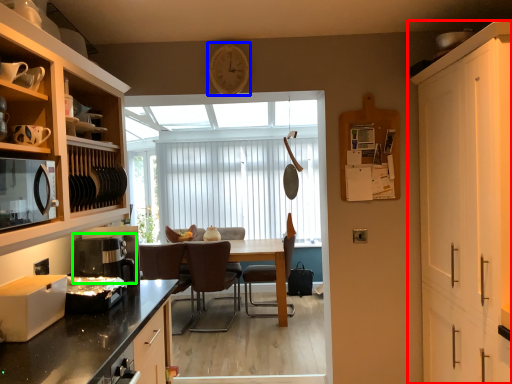
Question: Considering the real-world distances, which object is closest to cabinetry (highlighted by a red box)? clock (highlighted by a blue box) or coffee machine (highlighted by a green box).

Choices:
 (A) clock
 (B) coffee machine

Answer: (A)